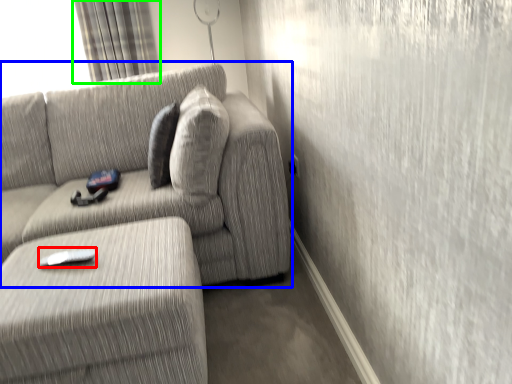
Question: Which is nearer to the remote (highlighted by a red box)? studio couch (highlighted by a blue box) or curtain (highlighted by a green box).

Choices:
 (A) studio couch
 (B) curtain

Answer: (A)